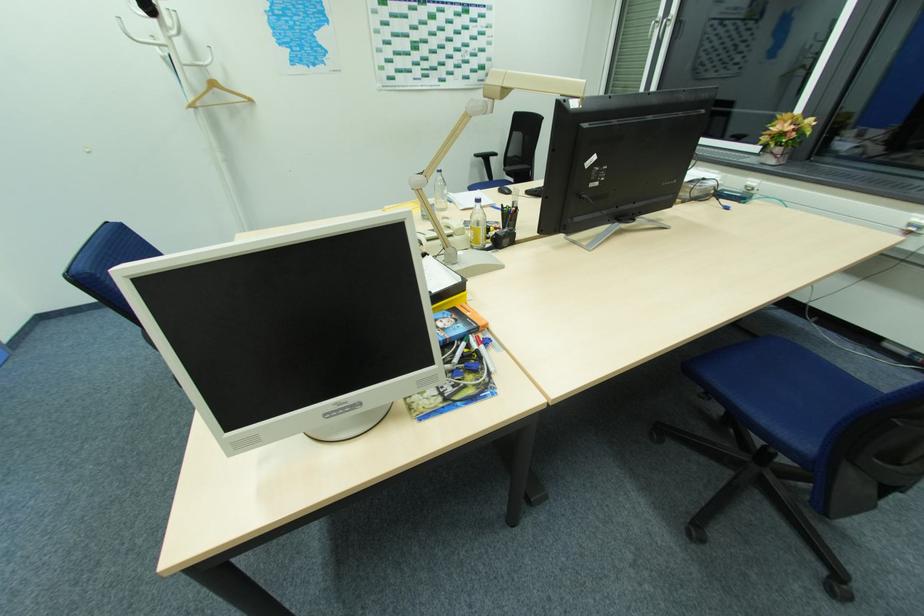
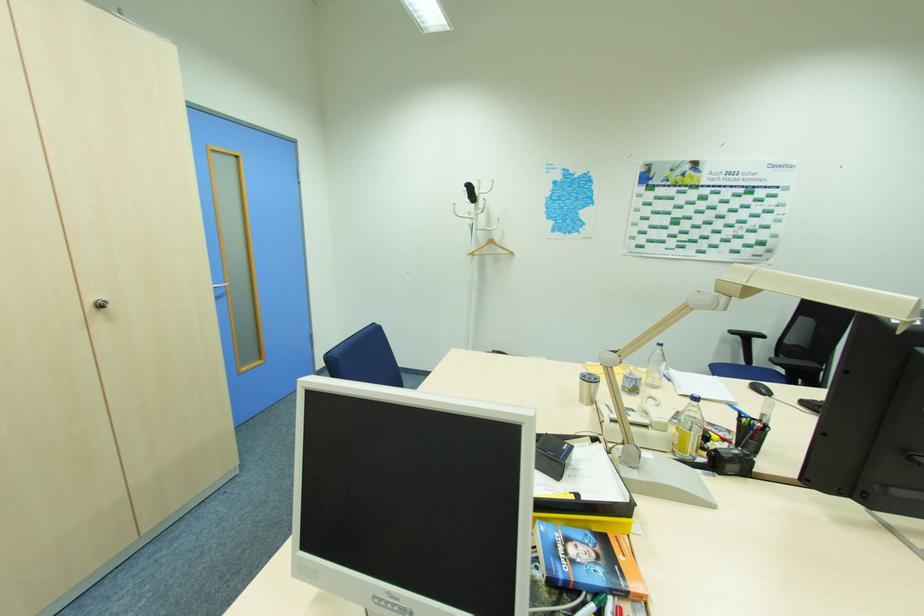
The point at (479, 156) is marked in the first image. Where is the corresponding point in the second image?

(734, 331)